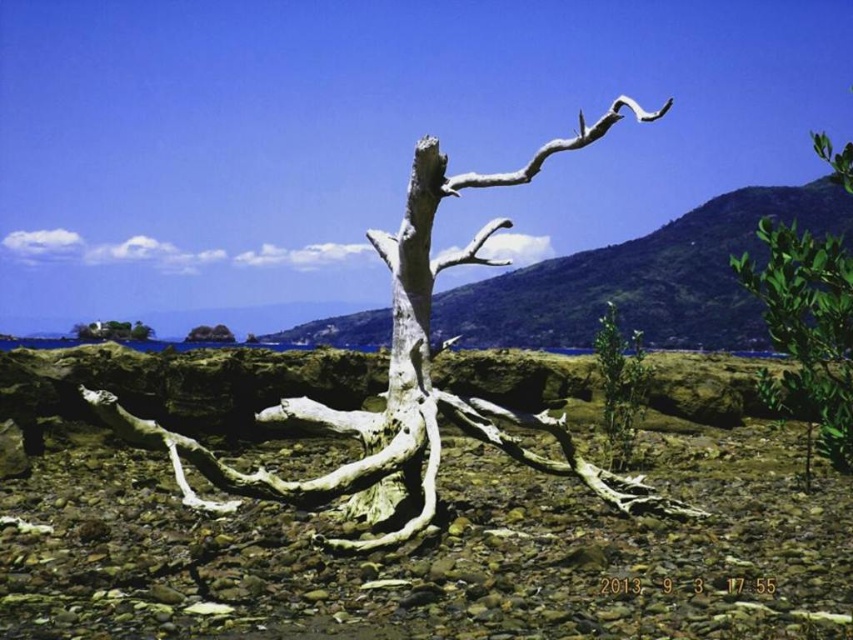
Who is higher up, white rough wood at center or green leafy bush at right?

Positioned higher is green leafy bush at right.

Does white rough wood at center come behind green leafy bush at right?

Yes, white rough wood at center is behind green leafy bush at right.

Between point (300, 404) and point (747, 285), which one is positioned behind?

Point (300, 404)

Identify the location of white rough wood at center. tap(409, 381).

Who is positioned more to the left, white rough wood at center or white textured driftwood at center?

Positioned to the left is white textured driftwood at center.

What do you see at coordinates (409, 381) in the screenshot?
I see `white rough wood at center` at bounding box center [409, 381].

I want to click on white rough wood at center, so click(x=409, y=381).

Does green leafy bush at right have a lesser height compared to green leafy plant at center?

In fact, green leafy bush at right may be taller than green leafy plant at center.

Who is shorter, green leafy bush at right or green leafy plant at center?

green leafy plant at center

This screenshot has height=640, width=853. Identify the location of green leafy bush at right. (807, 330).